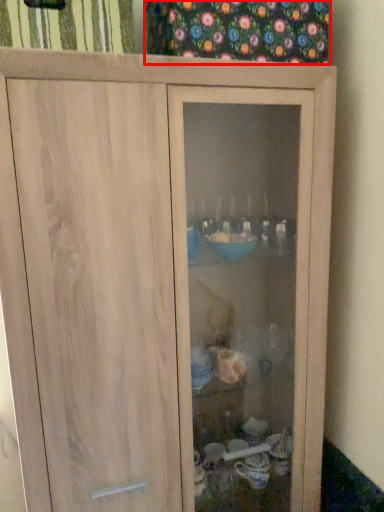
Question: Considering the relative positions of curtain (annotated by the red box) and curtain in the image provided, where is curtain (annotated by the red box) located with respect to the staircase?

Choices:
 (A) left
 (B) right

Answer: (B)